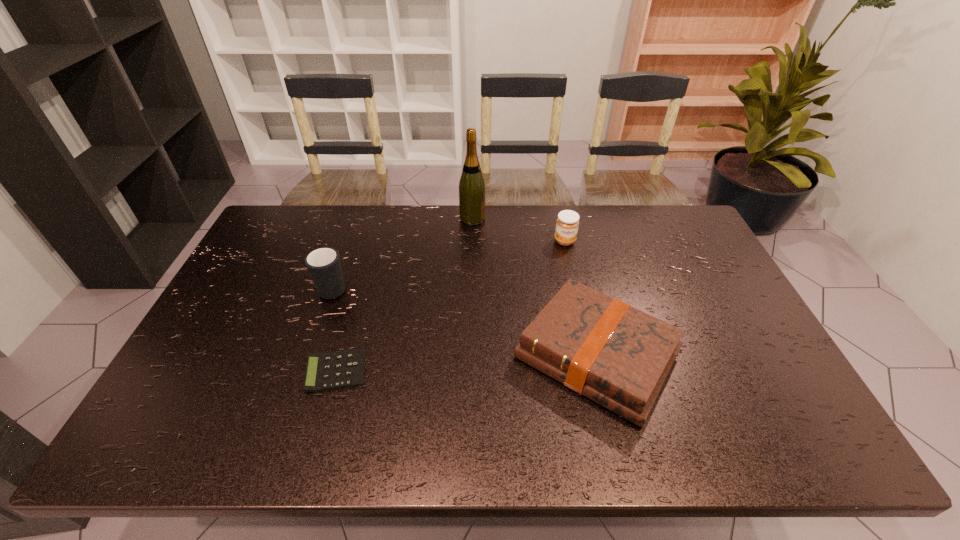
This screenshot has height=540, width=960. Find the location of `object that ranks as the third closest to the third object from left to right`. object that ranks as the third closest to the third object from left to right is located at coordinates (323, 264).

Locate which object ranks second in proximity to the wine bottle. Please provide its 2D coordinates. Your answer should be formatted as a tuple, i.e. [(x, y)], where the tuple contains the x and y coordinates of a point satisfying the conditions above.

[(618, 356)]

Locate an element on the screen. The height and width of the screenshot is (540, 960). free space that satisfies the following two spatial constraints: 1. on the front-facing side of the farthest object; 2. on the front side of the calculator is located at coordinates (469, 371).

Find the location of `free spot that satisfies the following two spatial constraints: 1. on the front-facing side of the farthest object; 2. on the left side of the hardback book`. free spot that satisfies the following two spatial constraints: 1. on the front-facing side of the farthest object; 2. on the left side of the hardback book is located at coordinates (469, 355).